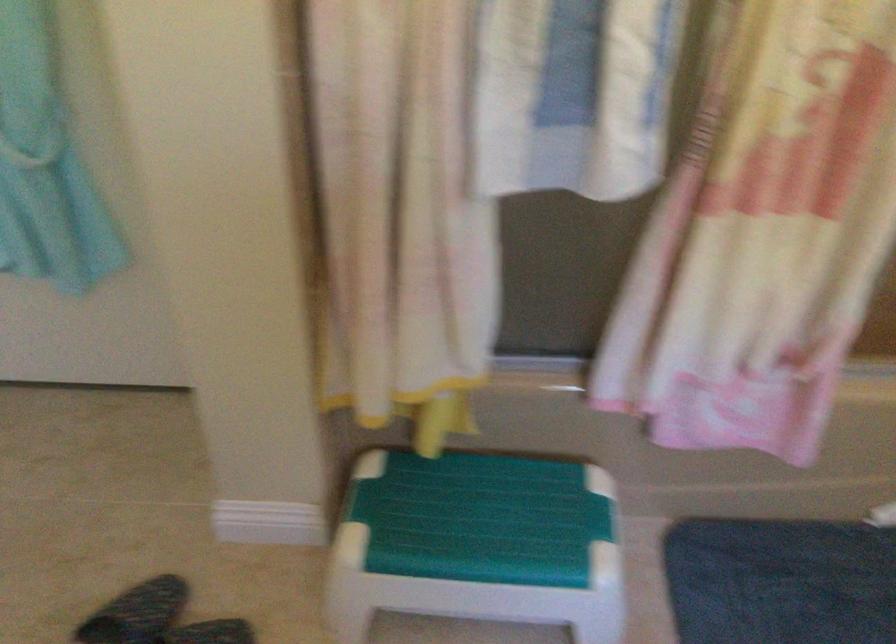
Based on the continuous images, in which direction is the camera rotating?

The camera's rotation is toward right-down.